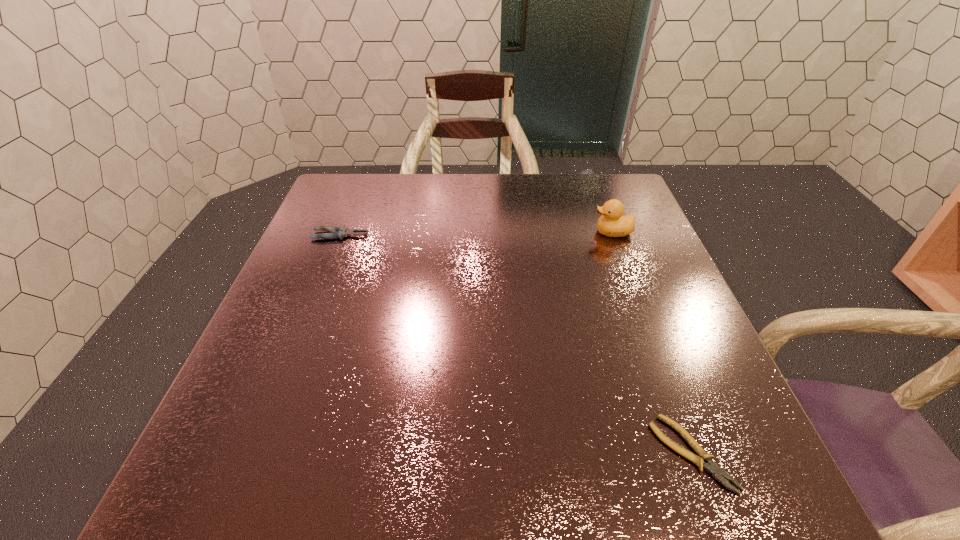
You are a GUI agent. You are given a task and a screenshot of the screen. Output one action in this format:
    pyautogui.click(x=<x>, y=<y>)
    Task: Click on the free space at the far right corner
    The image size is (960, 540).
    Given the screenshot: What is the action you would take?
    pyautogui.click(x=604, y=187)

Find the location of a particular element. Image resolution: width=960 pixels, height=540 pixels. vacant space at the near right corner of the desktop is located at coordinates (753, 478).

Find the location of a particular element. This screenshot has width=960, height=540. free space between the tallest object and the taller pliers is located at coordinates (476, 234).

Where is `vacant region between the left pliers and the nearer pliers`? vacant region between the left pliers and the nearer pliers is located at coordinates (516, 344).

Identify the location of vacant region between the left pliers and the shorter pliers. The height and width of the screenshot is (540, 960). (516, 344).

Where is `free spot between the tallest object and the farther pliers`? The width and height of the screenshot is (960, 540). free spot between the tallest object and the farther pliers is located at coordinates (476, 234).

This screenshot has height=540, width=960. Identify the location of vacant space in between the tallest object and the leftmost object. (476, 234).

Identify the location of free area in between the shorter pliers and the second tallest object. (516, 344).

I want to click on vacant space that's between the shortest object and the tallest object, so click(x=652, y=343).

Image resolution: width=960 pixels, height=540 pixels. What are the coordinates of `free point between the right pliers and the left pliers` in the screenshot? It's located at (516, 344).